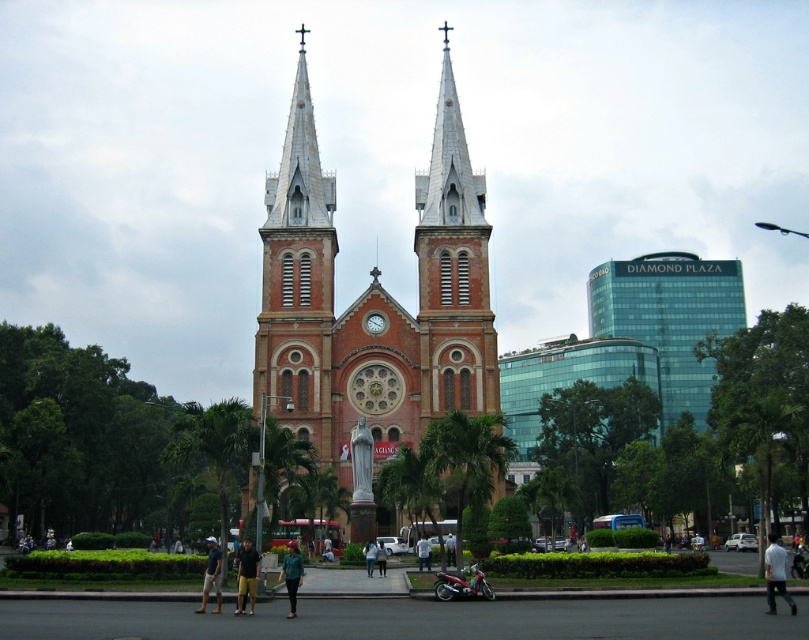
Between red brick church at center and yellow shorts at center, which one has more height?

red brick church at center is taller.

Is red brick church at center thinner than yellow shorts at center?

No.

This screenshot has width=809, height=640. Identify the location of red brick church at center. (373, 300).

I want to click on red brick church at center, so click(373, 300).

Is white cotton shirt at lower right behind light blue denim jeans at center?

No, white cotton shirt at lower right is in front of light blue denim jeans at center.

Is point (776, 556) positioned before point (375, 548)?

Yes.

Between point (774, 579) and point (367, 573), which one is positioned behind?

The point (367, 573) is behind.

Identify the location of white cotton shirt at lower right. Image resolution: width=809 pixels, height=640 pixels. (776, 573).

Is white cotton shirt at lower right bigger than yellow shorts at center?

Yes, white cotton shirt at lower right is bigger than yellow shorts at center.

Who is more forward, (771, 588) or (248, 540)?

Point (771, 588)

At what (x,y) coordinates should I click in order to perform the action: click on white cotton shirt at lower right. Please return your answer as a coordinate pair (x, y). The width and height of the screenshot is (809, 640). Looking at the image, I should click on (776, 573).